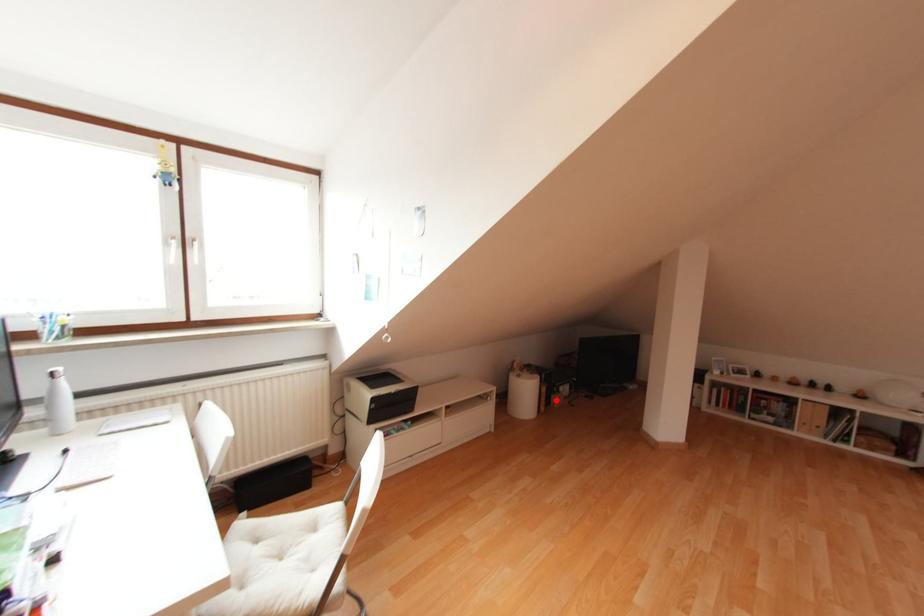
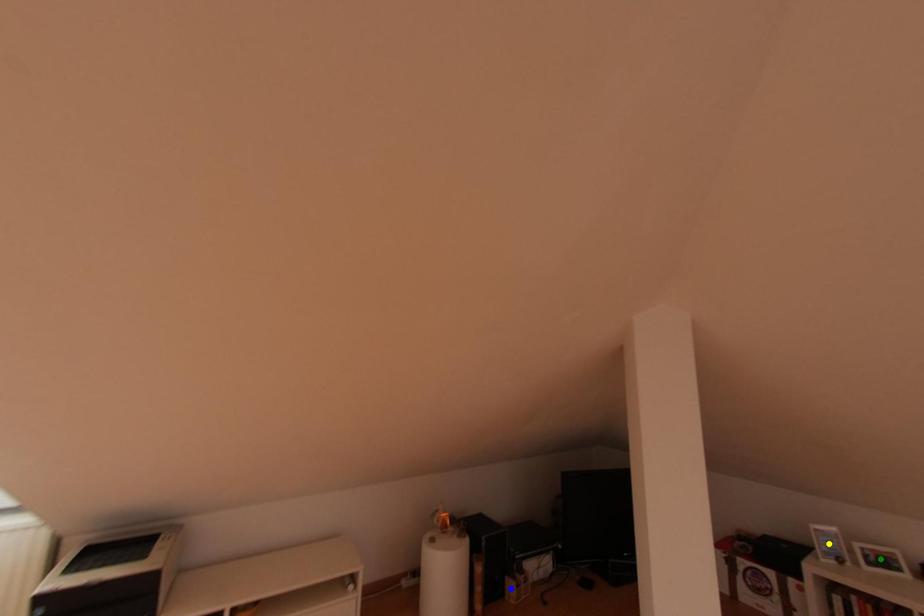
Question: I am providing you with two images of the same scene from different viewpoints. A red point is marked on the first image. You are given multiple points on the second image. In image 2, which mark is for the same physical point as the one in image 1?

Choices:
 (A) yellow point
 (B) blue point
 (C) green point

Answer: (B)